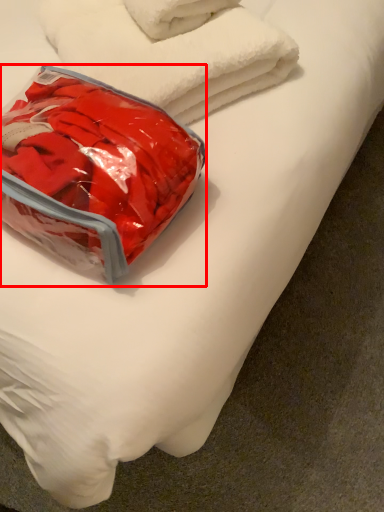
Question: In this image, where is pack (annotated by the red box) located relative to towel?

Choices:
 (A) right
 (B) left

Answer: (B)